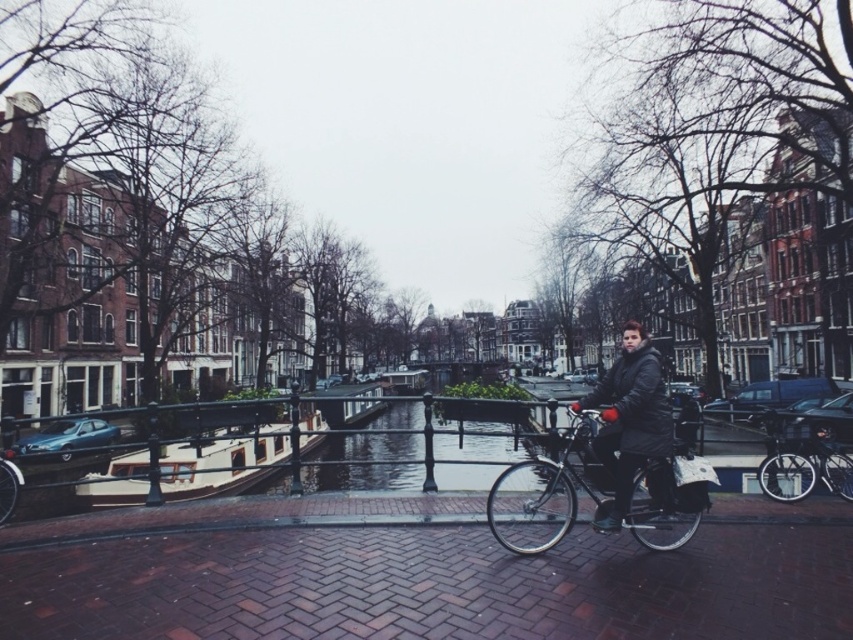
You are standing at the point marked as point [235,456] in the image. What object is located at this point?

The wooden polished boat at center left is located at point [235,456].